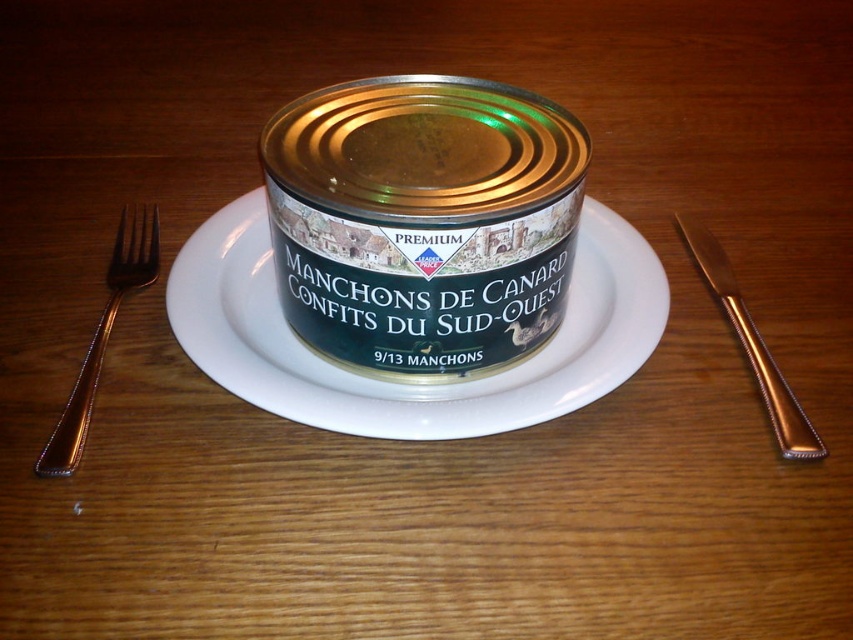
Question: Observing the image, what is the correct spatial positioning of gold polished fork at left in reference to gold metallic knife at right?

Choices:
 (A) left
 (B) right

Answer: (A)

Question: Which point is farther to the camera?

Choices:
 (A) (619, 340)
 (B) (740, 307)
 (C) (80, 376)

Answer: (B)

Question: Can you confirm if white ceramic plate at center is bigger than gold polished fork at left?

Choices:
 (A) no
 (B) yes

Answer: (B)

Question: Which point is closer to the camera taking this photo?

Choices:
 (A) (780, 452)
 (B) (335, 196)

Answer: (B)

Question: Does metallic can at center have a lesser width compared to white ceramic plate at center?

Choices:
 (A) yes
 (B) no

Answer: (A)

Question: Considering the real-world distances, which object is farthest from the gold polished fork at left?

Choices:
 (A) gold metallic knife at right
 (B) white ceramic plate at center
 (C) metallic can at center

Answer: (A)